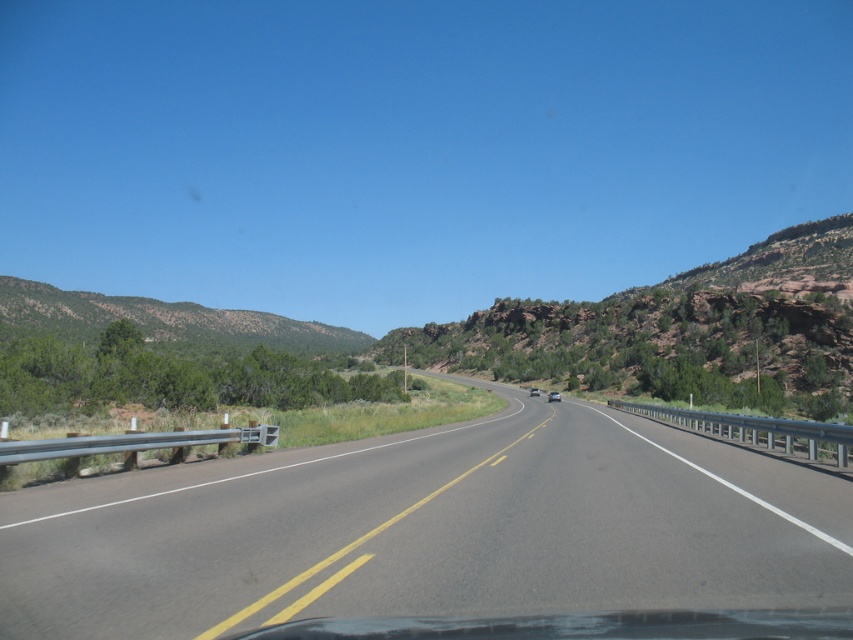
Question: Can you confirm if green textured hillside at left is thinner than white glossy sedan at center?

Choices:
 (A) yes
 (B) no

Answer: (B)

Question: Estimate the real-world distances between objects in this image. Which object is farther from the asphalt road at center?

Choices:
 (A) green textured hillside at left
 (B) metallic silver sedan at center
 (C) white glossy sedan at center

Answer: (A)

Question: Based on their relative distances, which object is nearer to the green textured hillside at left?

Choices:
 (A) metallic silver sedan at center
 (B) white glossy sedan at center

Answer: (B)

Question: Is asphalt road at center further to the viewer compared to white glossy sedan at center?

Choices:
 (A) no
 (B) yes

Answer: (A)

Question: Which of the following is the farthest from the observer?

Choices:
 (A) metallic silver sedan at center
 (B) asphalt road at center

Answer: (A)

Question: Does green textured hillside at left appear under white glossy sedan at center?

Choices:
 (A) no
 (B) yes

Answer: (A)